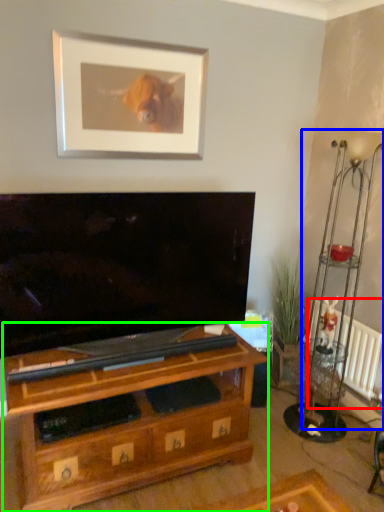
Question: Which object is the closest to the radiator (highlighted by a red box)? Choose among these: lamp (highlighted by a blue box) or shelf (highlighted by a green box).

Choices:
 (A) lamp
 (B) shelf

Answer: (A)